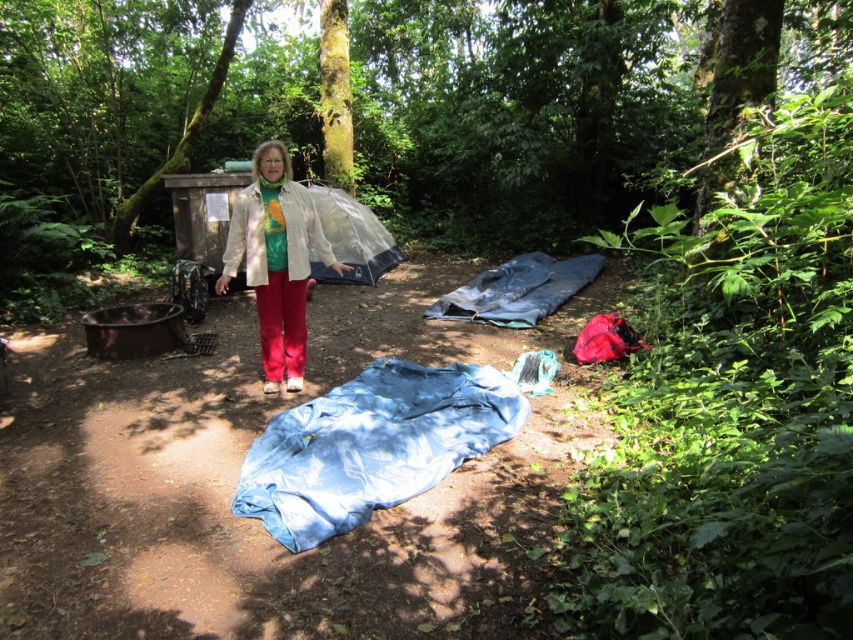
Question: From the image, what is the correct spatial relationship of blue tarp at center in relation to light beige jacket at center?

Choices:
 (A) left
 (B) right

Answer: (B)

Question: Which point is farther from the camera taking this photo?

Choices:
 (A) (407, 362)
 (B) (250, 276)

Answer: (A)

Question: Does blue tarp at center have a smaller size compared to light beige jacket at center?

Choices:
 (A) no
 (B) yes

Answer: (A)

Question: Is blue tarp at center to the right of light beige jacket at center from the viewer's perspective?

Choices:
 (A) no
 (B) yes

Answer: (B)

Question: Which point is farther from the camera taking this photo?

Choices:
 (A) (273, 173)
 (B) (262, 433)

Answer: (A)